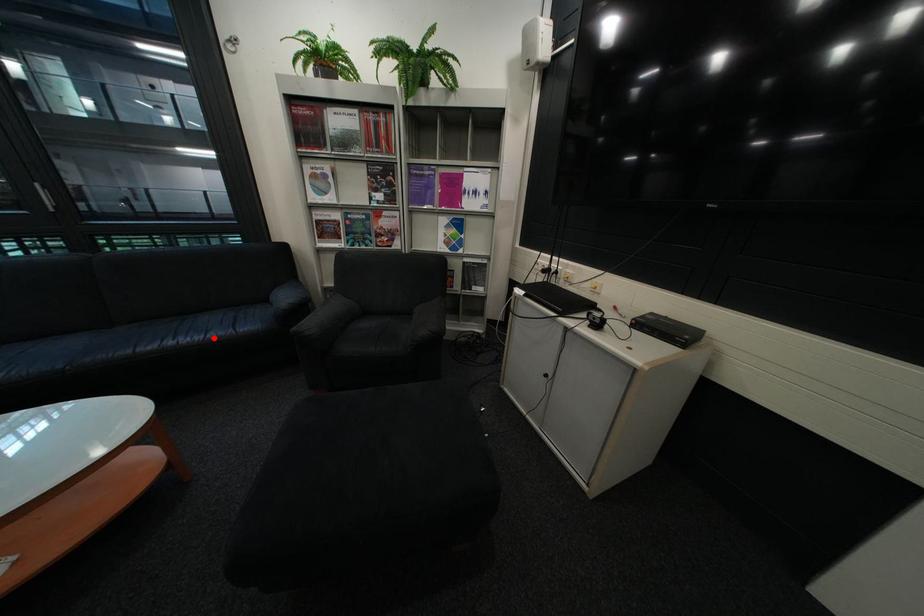
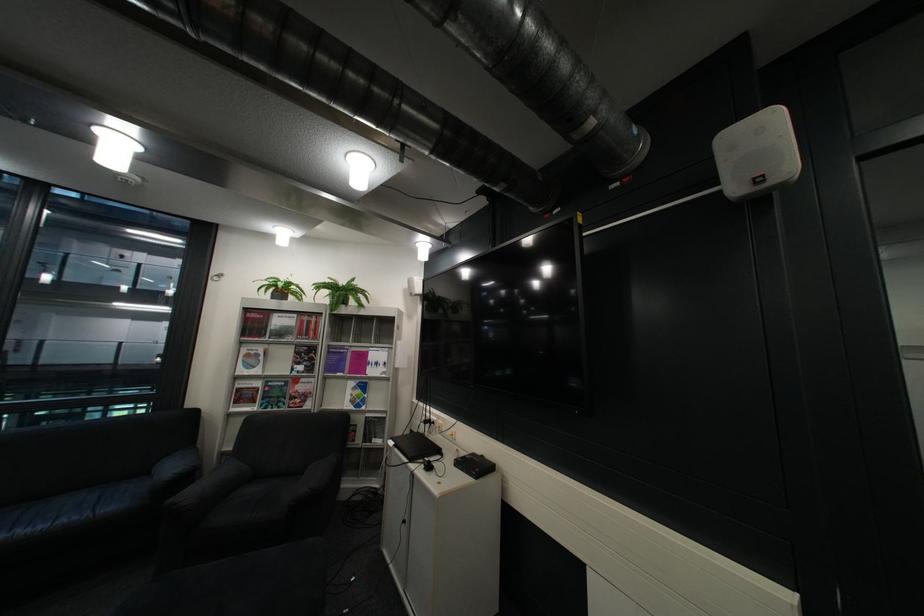
Where in the second image is the point corresponding to the highlighted location from the first image?

(58, 527)